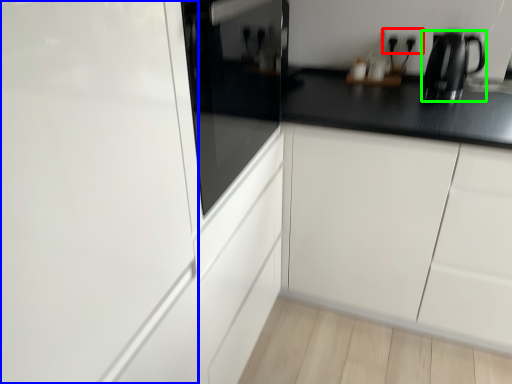
Question: Which is nearer to the electric outlet (highlighted by a red box)? glass door (highlighted by a blue box) or kitchen appliance (highlighted by a green box).

Choices:
 (A) glass door
 (B) kitchen appliance

Answer: (B)